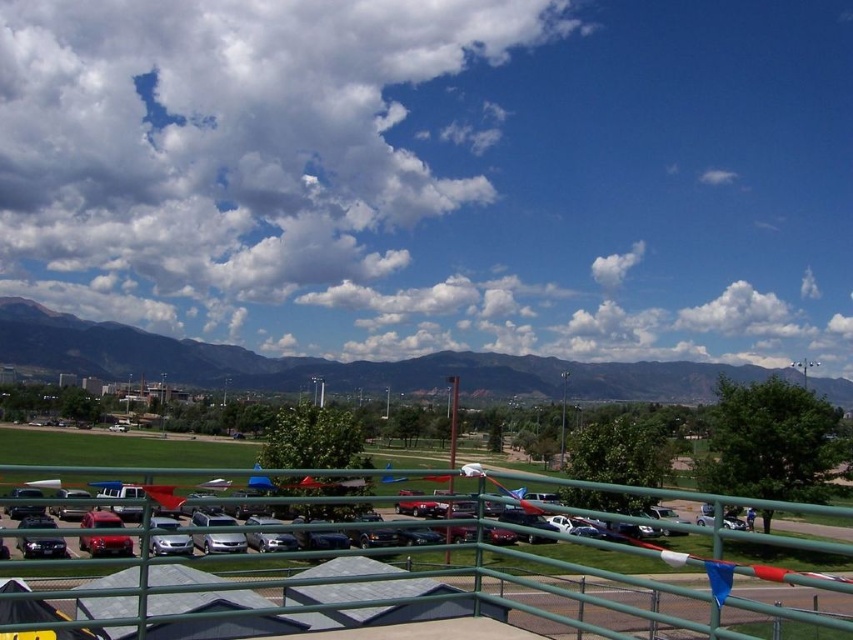
You are standing on a balcony and looking out. You see a white fluffy cloud at upper center and a green metal railing at center. Which object is closer to you?

The white fluffy cloud at upper center is closer to you because it is further to the viewer than the green metal railing at center.

You are looking at the image and want to locate the white fluffy cloud at upper center. According to the coordinates provided, where exactly is it positioned?

The white fluffy cloud at upper center is located at point coordinates of (247, 164).